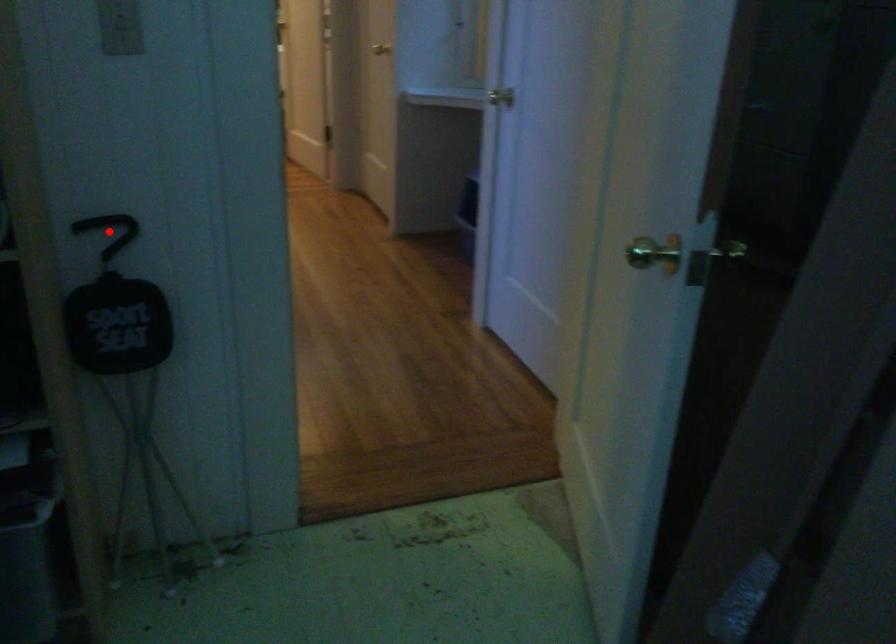
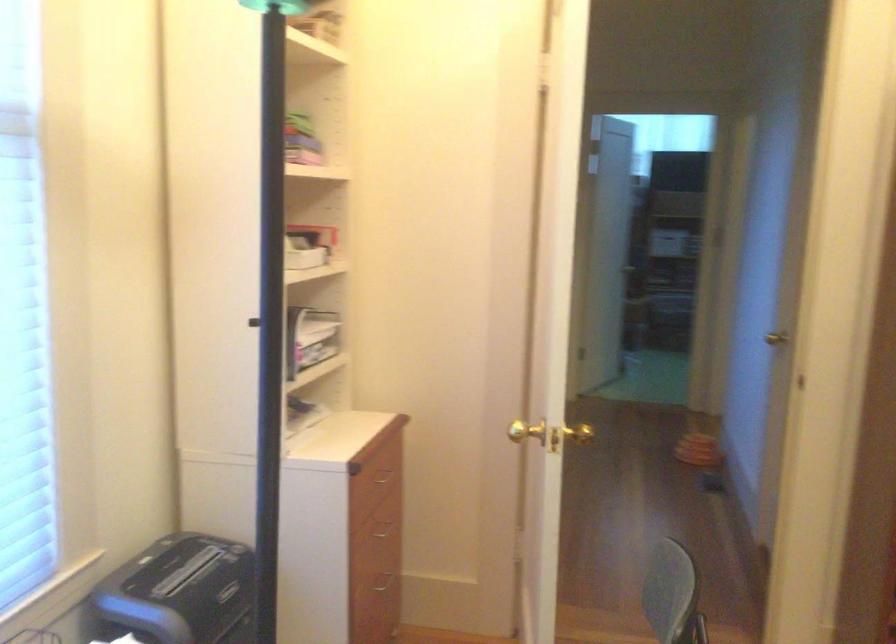
Question: I am providing you with two images of the same scene from different viewpoints. A red point is marked on the first image. Is the red point's position out of view in image 2?

Choices:
 (A) Yes
 (B) No

Answer: (A)